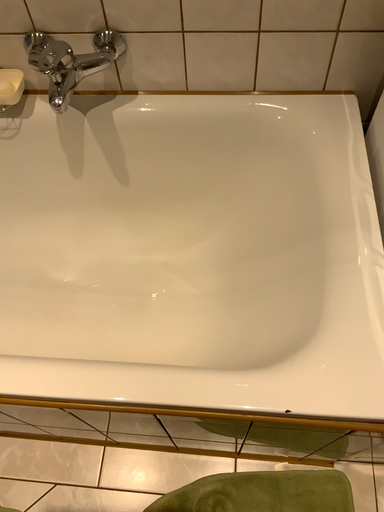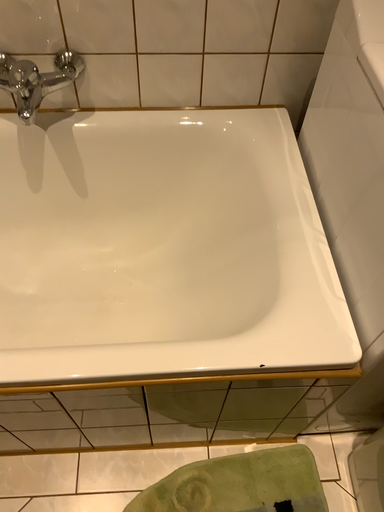
Question: How did the camera likely rotate when shooting the video?

Choices:
 (A) rotated left
 (B) rotated right

Answer: (B)